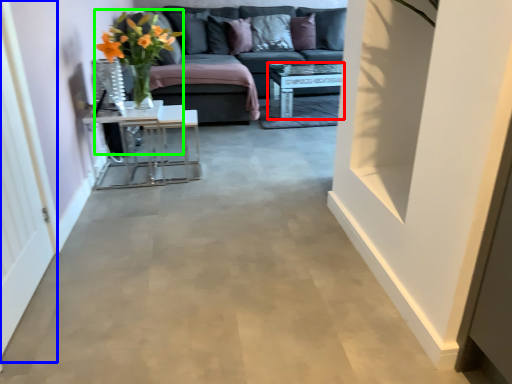
Question: Which is nearer to the table (highlighted by a red box)? glass door (highlighted by a blue box) or floral arrangement (highlighted by a green box).

Choices:
 (A) glass door
 (B) floral arrangement

Answer: (B)